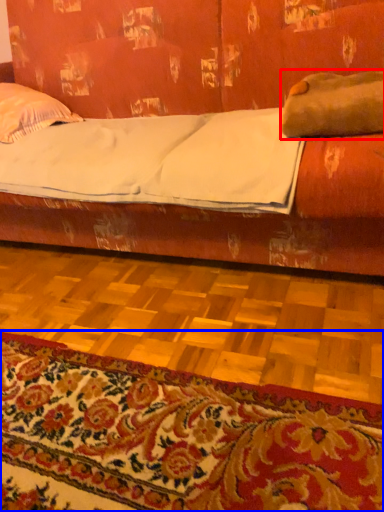
Question: Which point is closer to the camera, pillow (highlighted by a red box) or mat (highlighted by a blue box)?

Choices:
 (A) pillow
 (B) mat

Answer: (B)